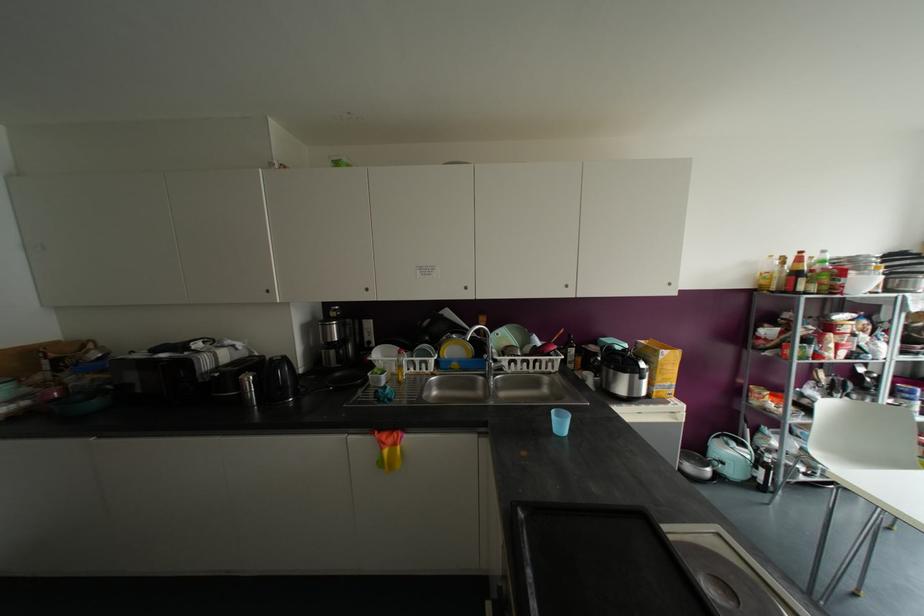
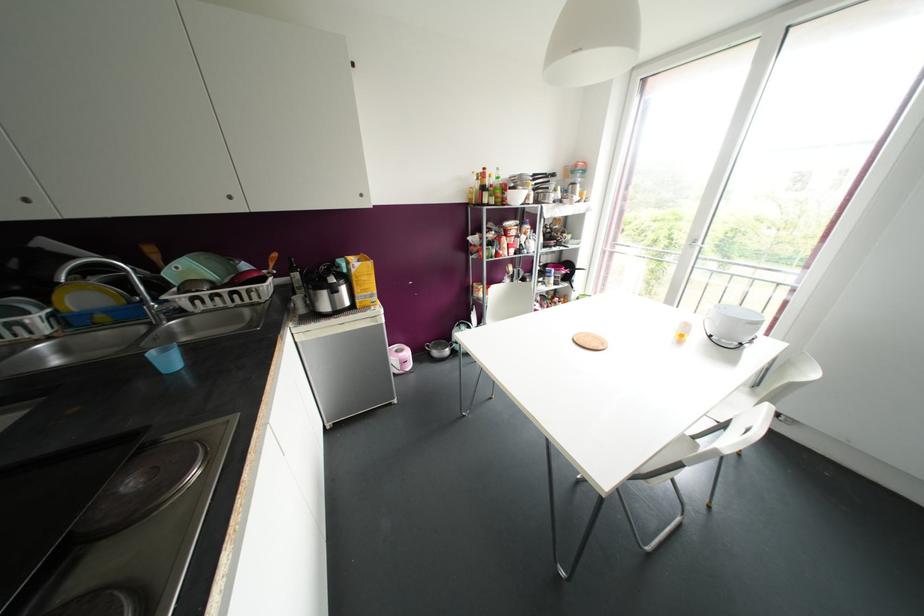
The point at (454, 363) is marked in the first image. Where is the corresponding point in the second image?

(101, 317)